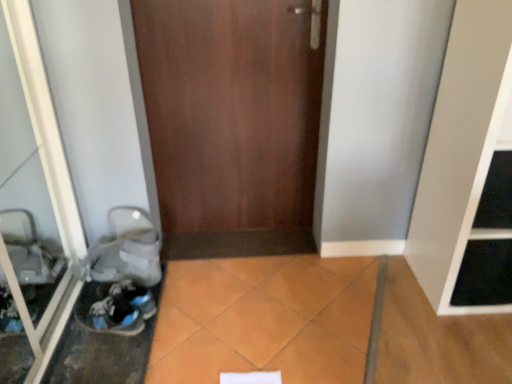
What do you see at coordinates (477, 203) in the screenshot?
I see `white matte shelf at right` at bounding box center [477, 203].

What do you see at coordinates (232, 122) in the screenshot? This screenshot has width=512, height=384. I see `wooden door at center` at bounding box center [232, 122].

In order to click on transparent glass door at left in this screenshot , I will do `click(33, 196)`.

Can you confirm if white matte shelf at right is shorter than wooden door at center?

In fact, white matte shelf at right may be taller than wooden door at center.

Are white matte shelf at right and wooden door at center making contact?

No, white matte shelf at right is not with wooden door at center.

From the image's perspective, would you say white matte shelf at right is shown under wooden door at center?

Yes.

Based on the photo, how different are the orientations of white matte shelf at right and wooden door at center in degrees?

2.55 degrees separate the facing orientations of white matte shelf at right and wooden door at center.

From a real-world perspective, is blue suede sneakers at lower left below transparent glass door at left?

Yes, from a real-world perspective, blue suede sneakers at lower left is beneath transparent glass door at left.

Can you confirm if blue suede sneakers at lower left is thinner than transparent glass door at left?

No.

In the scene shown: Can you see blue suede sneakers at lower left touching transparent glass door at left?

blue suede sneakers at lower left is not next to transparent glass door at left, and they're not touching.

Is white matte shelf at right further to the viewer compared to blue suede sneakers at lower left?

No, white matte shelf at right is closer to the viewer.

Which is more to the right, white matte shelf at right or blue suede sneakers at lower left?

From the viewer's perspective, white matte shelf at right appears more on the right side.

From a real-world perspective, is white matte shelf at right positioned over blue suede sneakers at lower left based on gravity?

Indeed, from a real-world perspective, white matte shelf at right stands above blue suede sneakers at lower left.

Between white matte shelf at right and blue suede sneakers at lower left, which one has less height?

blue suede sneakers at lower left is shorter.

From a real-world perspective, who is located lower, wooden door at center or white matte shelf at right?

From a 3D spatial view, wooden door at center is below.

Which of these two, wooden door at center or white matte shelf at right, is bigger?

With larger size is white matte shelf at right.

From the image's perspective, is wooden door at center beneath white matte shelf at right?

No, from the image's perspective, wooden door at center is not beneath white matte shelf at right.

Which object is closer to the camera taking this photo, blue suede sneakers at lower left or wooden door at center?

blue suede sneakers at lower left.

Is blue suede sneakers at lower left aimed at wooden door at center?

No, blue suede sneakers at lower left does not turn towards wooden door at center.

Image resolution: width=512 pixels, height=384 pixels. I want to click on door on the right of blue suede sneakers at lower left, so (232, 122).

Which object is positioned more to the right, blue suede sneakers at lower left or white matte shelf at right?

From the viewer's perspective, white matte shelf at right appears more on the right side.

Is white matte shelf at right located within blue suede sneakers at lower left?

Definitely not — white matte shelf at right is not inside blue suede sneakers at lower left.

From a real-world perspective, does blue suede sneakers at lower left stand above white matte shelf at right?

Actually, blue suede sneakers at lower left is physically below white matte shelf at right in the real world.

From the image's perspective, is blue suede sneakers at lower left above or below white matte shelf at right?

blue suede sneakers at lower left is situated lower than white matte shelf at right in the image.

Can you confirm if transparent glass door at left is positioned to the left of wooden door at center?

Indeed, transparent glass door at left is positioned on the left side of wooden door at center.

From a real-world perspective, which is physically above, transparent glass door at left or wooden door at center?

From a 3D spatial view, transparent glass door at left is above.

Considering the sizes of objects transparent glass door at left and wooden door at center in the image provided, who is taller, transparent glass door at left or wooden door at center?

Standing taller between the two is transparent glass door at left.

Would you say transparent glass door at left is outside wooden door at center?

Indeed, transparent glass door at left is completely outside wooden door at center.

Identify the location of door below the white matte shelf at right (from a real-world perspective). (232, 122).

Find the location of a particular element. Image resolution: width=512 pixels, height=384 pixels. footwear on the right of transparent glass door at left is located at coordinates (116, 308).

Which object lies nearer to the anchor point blue suede sneakers at lower left, white matte shelf at right or wooden door at center?

Among the two, wooden door at center is located nearer to blue suede sneakers at lower left.

Considering their positions, is wooden door at center positioned closer to white matte shelf at right than blue suede sneakers at lower left?

wooden door at center.

From the image, which object appears to be nearer to transparent glass door at left, wooden door at center or blue suede sneakers at lower left?

Based on the image, blue suede sneakers at lower left appears to be nearer to transparent glass door at left.

From the image, which object appears to be nearer to white matte shelf at right, blue suede sneakers at lower left or transparent glass door at left?

blue suede sneakers at lower left is positioned closer to the anchor white matte shelf at right.

Which object lies further to the anchor point white matte shelf at right, transparent glass door at left or blue suede sneakers at lower left?

Based on the image, transparent glass door at left appears to be further to white matte shelf at right.

Looking at this image, based on their spatial positions, is blue suede sneakers at lower left or white matte shelf at right further from wooden door at center?

Among the two, white matte shelf at right is located further to wooden door at center.

Which object lies nearer to the anchor point transparent glass door at left, wooden door at center or white matte shelf at right?

Among the two, wooden door at center is located nearer to transparent glass door at left.

From the image, which object appears to be farther from wooden door at center, white matte shelf at right or transparent glass door at left?

Among the two, white matte shelf at right is located further to wooden door at center.

The height and width of the screenshot is (384, 512). I want to click on door situated between blue suede sneakers at lower left and white matte shelf at right from left to right, so click(232, 122).

You are a GUI agent. You are given a task and a screenshot of the screen. Output one action in this format:
    pyautogui.click(x=<x>, y=<y>)
    Task: Click on the footwear situated between transparent glass door at left and white matte shelf at right from left to right
    Image resolution: width=512 pixels, height=384 pixels.
    Given the screenshot: What is the action you would take?
    pyautogui.click(x=116, y=308)

Locate an element on the screen. door situated between transparent glass door at left and white matte shelf at right from left to right is located at coordinates (232, 122).

I want to click on footwear between transparent glass door at left and wooden door at center from front to back, so click(x=116, y=308).